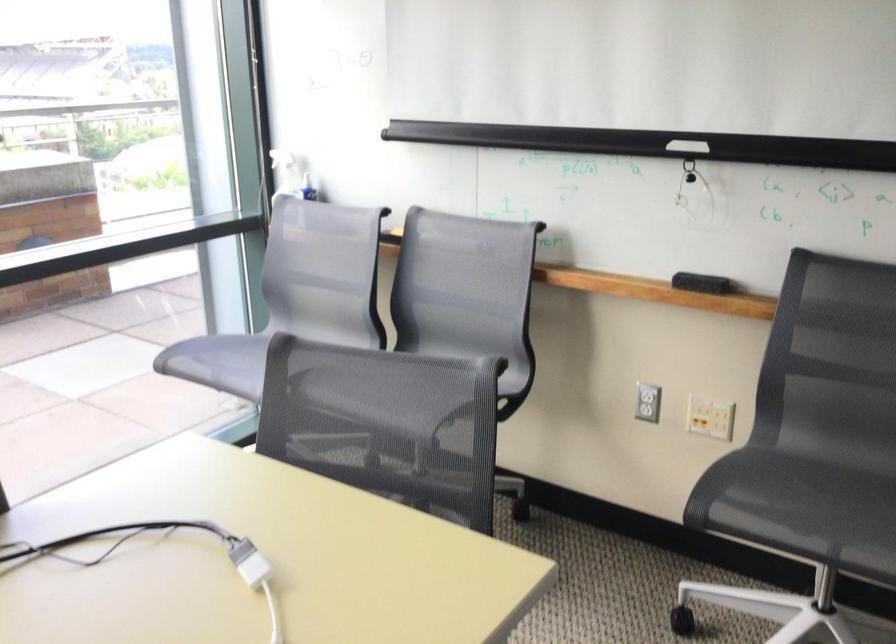
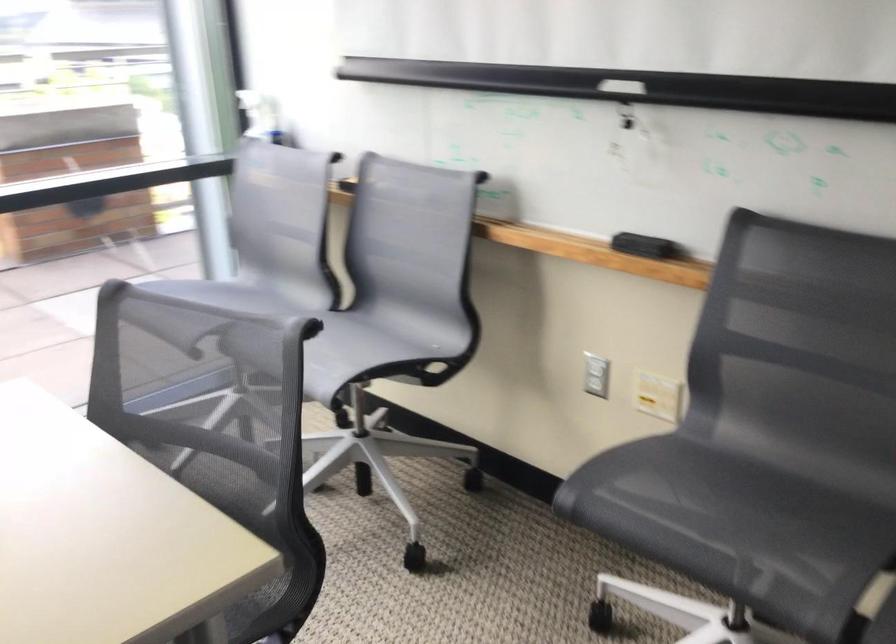
Find the pixel in the second image that matches [701,283] in the first image.

(643, 245)